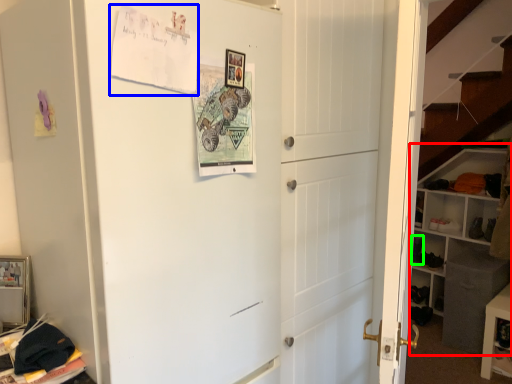
Question: Considering the real-world distances, which object is farthest from bookshelf (highlighted by a red box)? postcard (highlighted by a blue box) or shoe (highlighted by a green box)?

Choices:
 (A) postcard
 (B) shoe

Answer: (A)